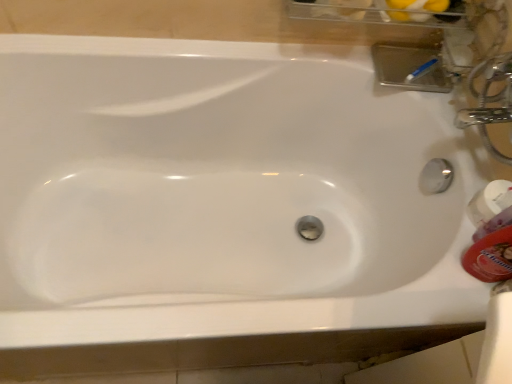
Find the location of `vacant space to the left of orange plastic mouthwash at right, acting as the second mouthwash starting from the back`. vacant space to the left of orange plastic mouthwash at right, acting as the second mouthwash starting from the back is located at coordinates (418, 289).